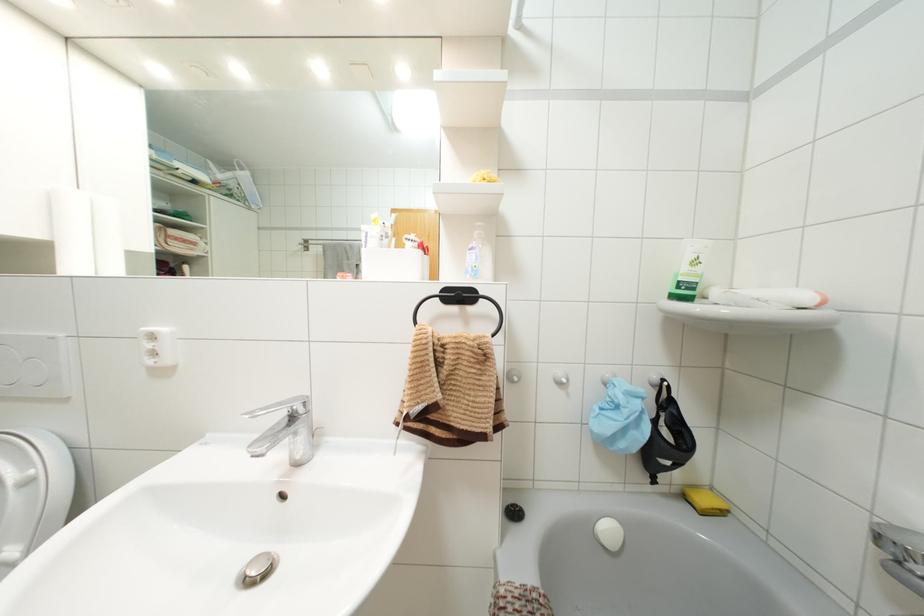
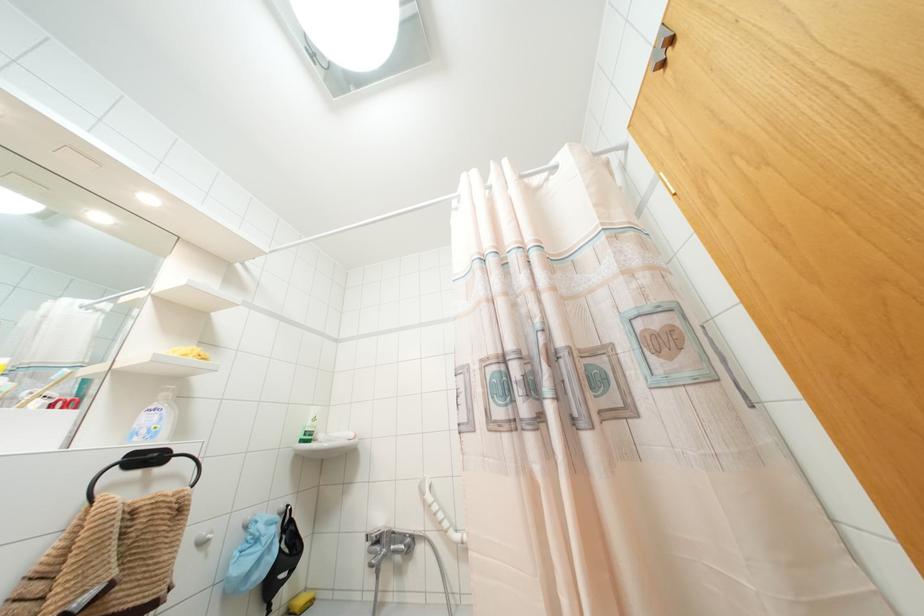
Where in the second image is the point corresponding to [473,256] from the first image?

(154, 418)